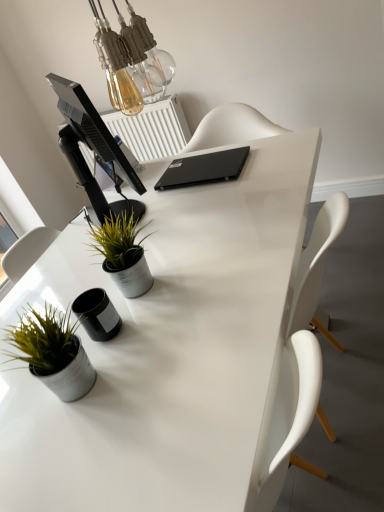
Find the location of a particular element. vacant space in front of black matte laptop at center is located at coordinates pyautogui.click(x=215, y=202).